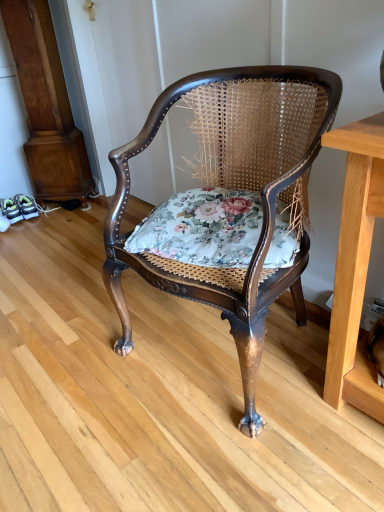
Identify the location of free space to the left of polished wood chair at center. This screenshot has height=512, width=384. (79, 358).